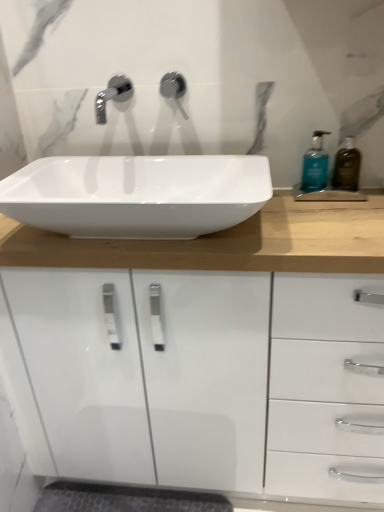
Question: Is the position of translucent amber bottle at right, which ranks as the first soap dispenser in right-to-left order, less distant than that of teal glass soap dispenser at right, the second soap dispenser positioned from the right?

Choices:
 (A) no
 (B) yes

Answer: (B)

Question: Is translucent amber bottle at right, which ranks as the first soap dispenser in right-to-left order, positioned behind teal glass soap dispenser at right, the first soap dispenser positioned from the left?

Choices:
 (A) no
 (B) yes

Answer: (A)

Question: Is teal glass soap dispenser at right, the first soap dispenser positioned from the left, inside translucent amber bottle at right, marked as the 2th soap dispenser in a left-to-right arrangement?

Choices:
 (A) yes
 (B) no

Answer: (B)

Question: Is translucent amber bottle at right, which ranks as the first soap dispenser in right-to-left order, to the right of teal glass soap dispenser at right, the first soap dispenser positioned from the left, from the viewer's perspective?

Choices:
 (A) yes
 (B) no

Answer: (A)

Question: Does translucent amber bottle at right, marked as the 2th soap dispenser in a left-to-right arrangement, have a lesser width compared to teal glass soap dispenser at right, the first soap dispenser positioned from the left?

Choices:
 (A) no
 (B) yes

Answer: (B)

Question: In terms of height, does white glossy sink at center look taller or shorter compared to matte silver faucet at upper center?

Choices:
 (A) tall
 (B) short

Answer: (B)

Question: From the image's perspective, is white glossy sink at center positioned above or below matte silver faucet at upper center?

Choices:
 (A) below
 (B) above

Answer: (A)

Question: Based on their positions, is white glossy sink at center located to the left or right of matte silver faucet at upper center?

Choices:
 (A) right
 (B) left

Answer: (B)

Question: Is white glossy sink at center in front of or behind matte silver faucet at upper center in the image?

Choices:
 (A) front
 (B) behind

Answer: (A)

Question: Relative to translucent amber bottle at right, which ranks as the first soap dispenser in right-to-left order, is matte silver faucet at upper center in front or behind?

Choices:
 (A) front
 (B) behind

Answer: (B)

Question: From the image's perspective, is matte silver faucet at upper center located above or below translucent amber bottle at right, which ranks as the first soap dispenser in right-to-left order?

Choices:
 (A) above
 (B) below

Answer: (A)

Question: From a real-world perspective, is matte silver faucet at upper center positioned above or below translucent amber bottle at right, which ranks as the first soap dispenser in right-to-left order?

Choices:
 (A) above
 (B) below

Answer: (A)

Question: Does point (172, 77) appear closer or farther from the camera than point (354, 162)?

Choices:
 (A) farther
 (B) closer

Answer: (B)

Question: Considering the relative positions of translucent amber bottle at right, marked as the 2th soap dispenser in a left-to-right arrangement, and teal glass soap dispenser at right, the first soap dispenser positioned from the left, in the image provided, is translucent amber bottle at right, marked as the 2th soap dispenser in a left-to-right arrangement, to the left or to the right of teal glass soap dispenser at right, the first soap dispenser positioned from the left,?

Choices:
 (A) right
 (B) left

Answer: (A)

Question: From a real-world perspective, is translucent amber bottle at right, which ranks as the first soap dispenser in right-to-left order, above or below teal glass soap dispenser at right, the second soap dispenser positioned from the right?

Choices:
 (A) below
 (B) above

Answer: (A)